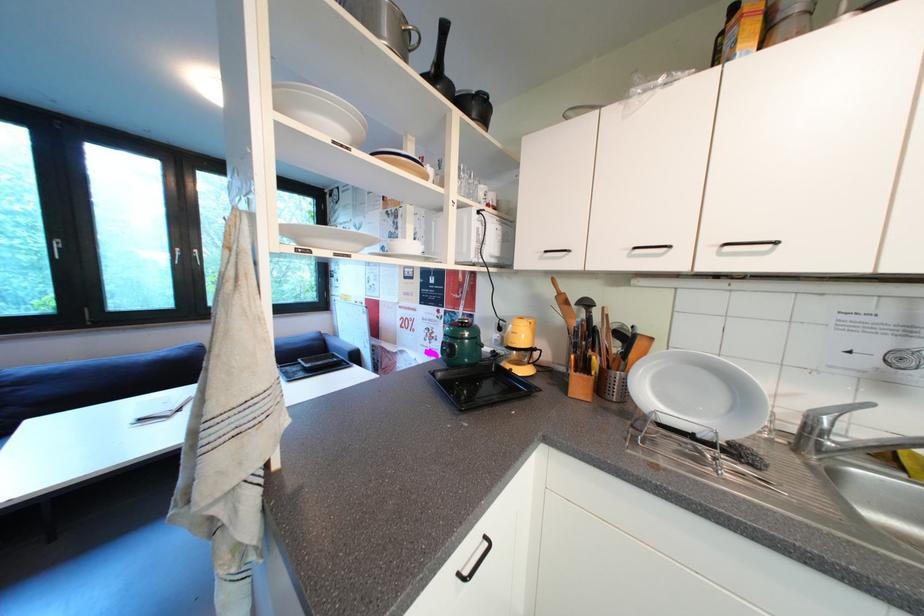
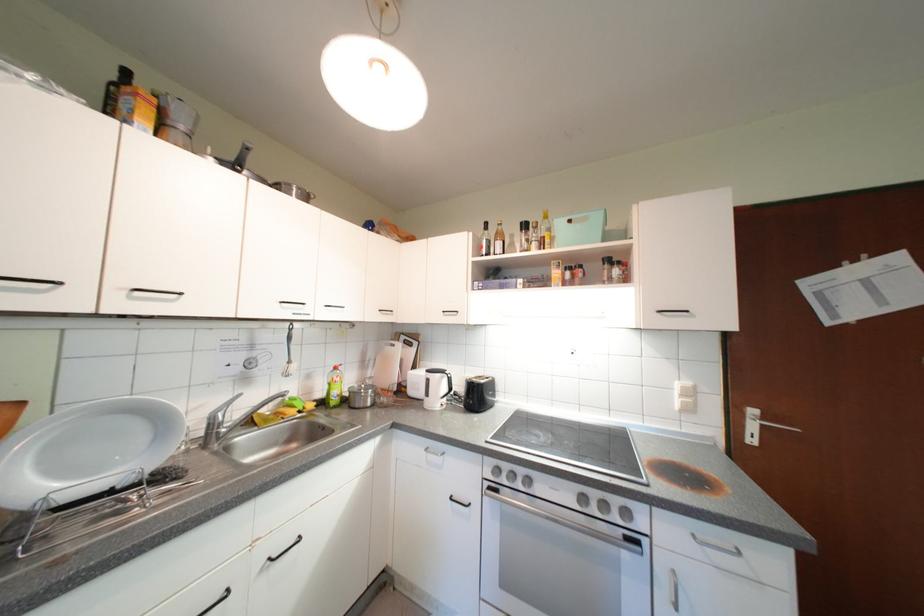
Where in the second image is the point corresponding to (x=727, y=256) from the first image?

(139, 300)